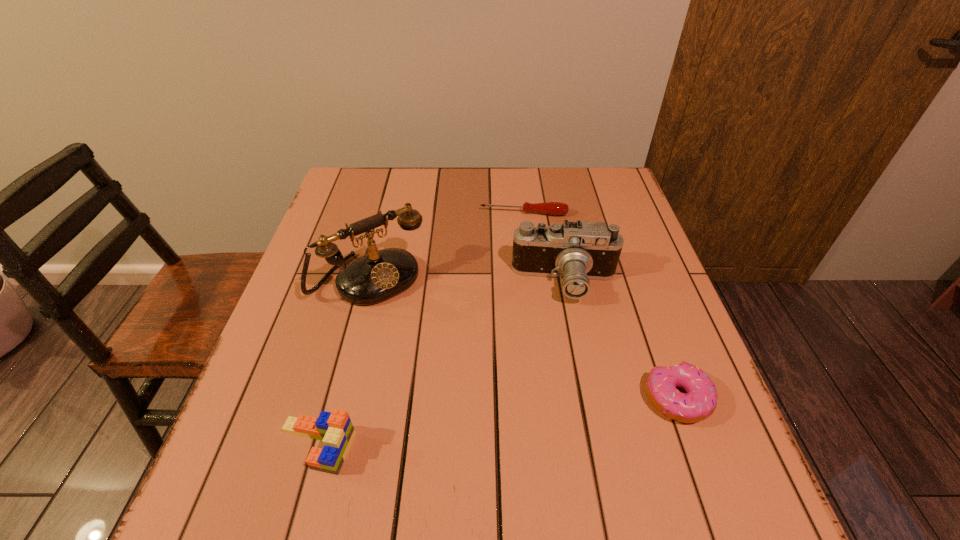
Identify the location of the third tallest object. (335, 430).

Find the location of `the fourth tallest object`. the fourth tallest object is located at coordinates (699, 402).

Locate an element on the screen. The image size is (960, 540). telephone is located at coordinates (379, 275).

Find the location of a particular element. This screenshot has width=960, height=540. the shortest object is located at coordinates (550, 208).

Locate an element on the screen. the farthest object is located at coordinates (550, 208).

The width and height of the screenshot is (960, 540). I want to click on the fourth shortest object, so click(578, 251).

Find the location of a particular element. free space located on the back of the third shortest object is located at coordinates (331, 392).

Where is `vacant space located 0.300m on the back of the second shortest object`? Image resolution: width=960 pixels, height=540 pixels. vacant space located 0.300m on the back of the second shortest object is located at coordinates (631, 270).

The image size is (960, 540). I want to click on vacant space situated 0.210m on the dial of the tallest object, so click(448, 363).

Image resolution: width=960 pixels, height=540 pixels. What are the coordinates of `vacant space situated 0.230m on the dial of the tallest object` in the screenshot? It's located at (453, 370).